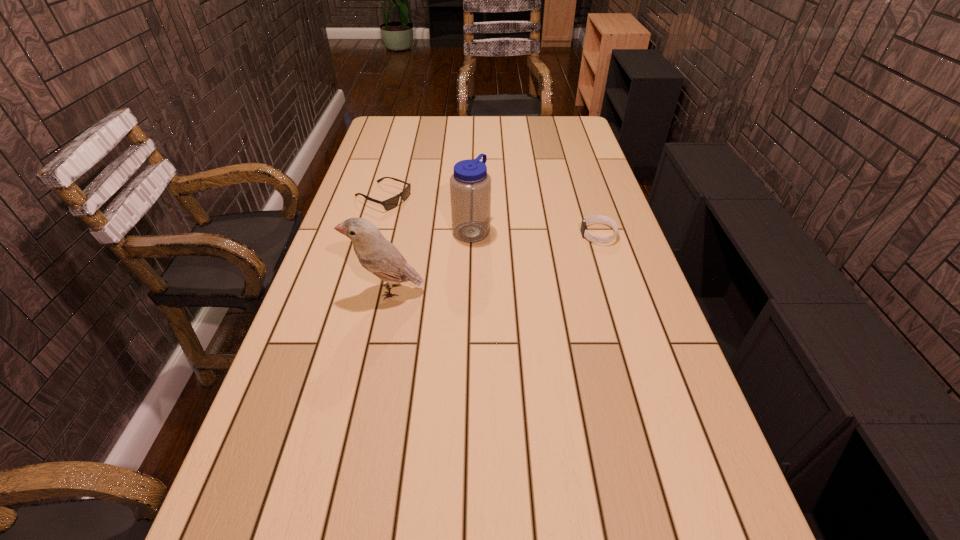
Locate which object is the closest to the sunglasses. Please provide its 2D coordinates. Your answer should be formatted as a tuple, i.e. [(x, y)], where the tuple contains the x and y coordinates of a point satisfying the conditions above.

[(470, 185)]

Find the location of a particular element. The image size is (960, 540). object identified as the closest to the nearest object is located at coordinates pos(470,185).

At what (x,y) coordinates should I click in order to perform the action: click on free space that satisfies the following two spatial constraints: 1. on the front side of the farthest object; 2. on the left side of the third object from left to right. Please return your answer as a coordinate pair (x, y). This screenshot has width=960, height=540. Looking at the image, I should click on (373, 231).

Where is `vacant space that satisfies the following two spatial constraints: 1. on the front side of the sunglasses; 2. on the left side of the water bottle`? The height and width of the screenshot is (540, 960). vacant space that satisfies the following two spatial constraints: 1. on the front side of the sunglasses; 2. on the left side of the water bottle is located at coordinates (373, 231).

The image size is (960, 540). In order to click on free location that satisfies the following two spatial constraints: 1. on the front side of the sunglasses; 2. at the face of the nearest object in this screenshot , I will do `click(356, 290)`.

The width and height of the screenshot is (960, 540). In order to click on blank area in the image that satisfies the following two spatial constraints: 1. on the front side of the farthest object; 2. at the face of the nearest object in this screenshot , I will do `click(356, 290)`.

Locate an element on the screen. vacant space that satisfies the following two spatial constraints: 1. on the front side of the sunglasses; 2. at the face of the nearest object is located at coordinates tap(356, 290).

Where is `vacant region that satisfies the following two spatial constraints: 1. on the front side of the sunglasses; 2. at the face of the bird`? vacant region that satisfies the following two spatial constraints: 1. on the front side of the sunglasses; 2. at the face of the bird is located at coordinates (356, 290).